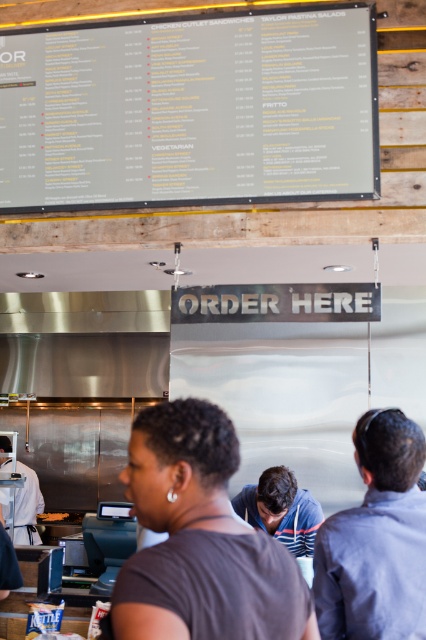
Question: Does gray matte menu board at upper center have a greater width compared to blue shirt at center?

Choices:
 (A) no
 (B) yes

Answer: (B)

Question: Which object is closer to the camera taking this photo?

Choices:
 (A) blue shirt at center
 (B) dark brown hair at center
 (C) gray matte menu board at upper center
 (D) golden crispy fries at center

Answer: (B)

Question: Where is blue shirt at center located in relation to golden crispy fries at center in the image?

Choices:
 (A) right
 (B) left

Answer: (A)

Question: Which object is farther from the camera taking this photo?

Choices:
 (A) golden crispy fries at center
 (B) dark brown hair at center
 (C) gray matte menu board at upper center
 (D) blue shirt at center

Answer: (A)

Question: Can you confirm if dark brown hair at center is positioned above blue shirt at center?

Choices:
 (A) no
 (B) yes

Answer: (B)

Question: Which object is positioned closest to the dark brown hair at center?

Choices:
 (A) golden crispy fries at center
 (B) gray matte menu board at upper center

Answer: (B)